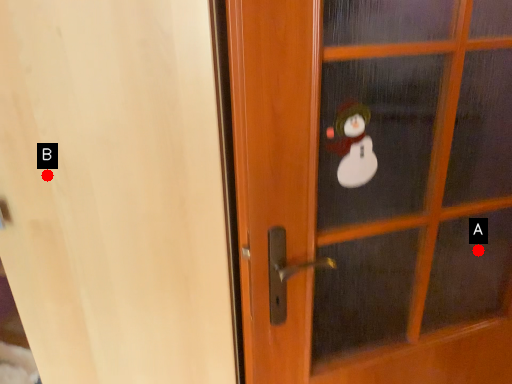
Question: Two points are circled on the image, labeled by A and B beside each circle. Which point is farther from the camera taking this photo?

Choices:
 (A) A is further
 (B) B is further

Answer: (A)